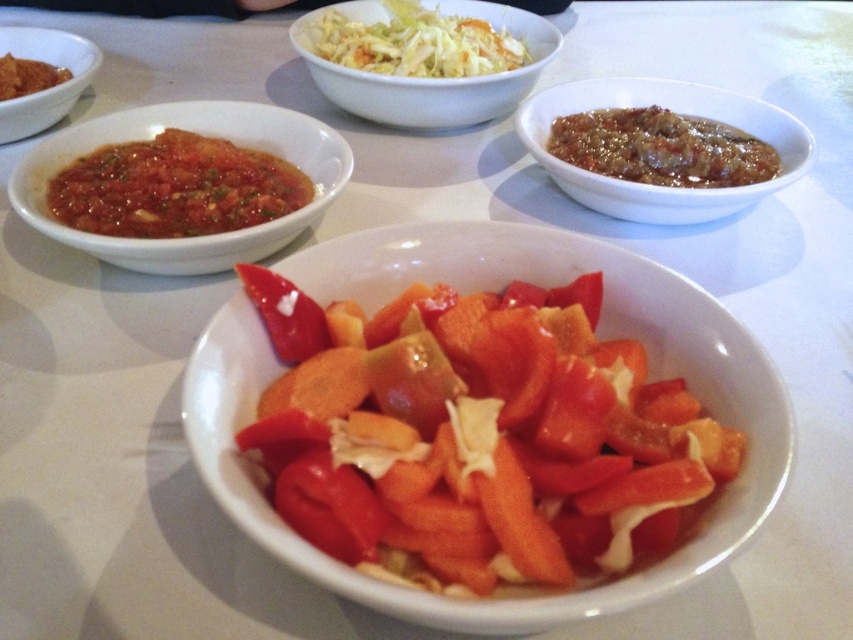
You are a food stylist arranging a photo shoot and need to place two sauces on a table. You have a slightly glossy tomato sauce at upper left and a slightly glossy brown sauce at upper right. Based on their sizes, which sauce would require a wider container to prevent overflow?

The slightly glossy brown sauce at upper right requires a wider container since it has a greater width than the slightly glossy tomato sauce at upper left.

You are setting up a buffet table and need to arrange the slightly glossy tomato sauce at upper left and the slightly glossy brown sauce at upper right. According to the image, which sauce is placed to the left of the other?

The slightly glossy tomato sauce at upper left is positioned on the left side of the slightly glossy brown sauce at upper right.